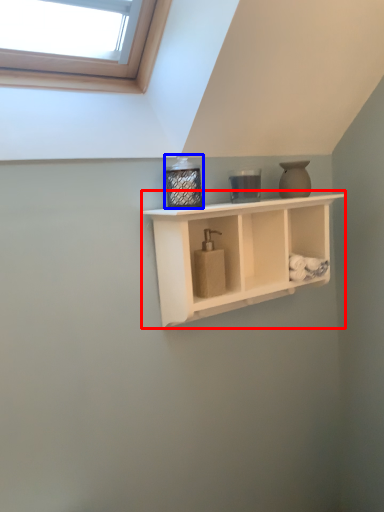
Question: Among these objects, which one is nearest to the camera, shelf (highlighted by a red box) or bottle (highlighted by a blue box)?

Choices:
 (A) shelf
 (B) bottle

Answer: (A)